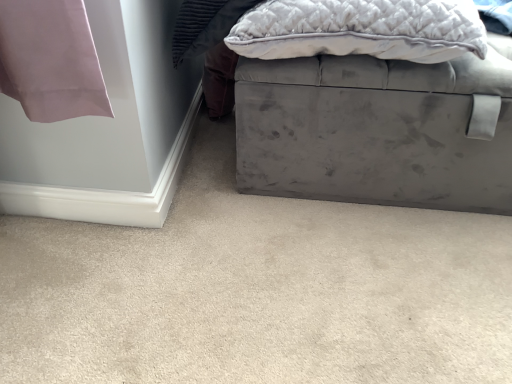
Question: From the image's perspective, relative to velvet gray ottoman at lower right, is velvet gray ottoman at center above or below?

Choices:
 (A) below
 (B) above

Answer: (B)

Question: In terms of height, does velvet gray ottoman at center look taller or shorter compared to velvet gray ottoman at lower right?

Choices:
 (A) short
 (B) tall

Answer: (B)

Question: Which object is the closest to the velvet gray ottoman at center?

Choices:
 (A) velvet gray ottoman at lower right
 (B) velvet gray pillow at upper right

Answer: (B)

Question: Estimate the real-world distances between objects in this image. Which object is farther from the velvet gray ottoman at lower right?

Choices:
 (A) velvet gray pillow at upper right
 (B) velvet gray ottoman at center

Answer: (A)